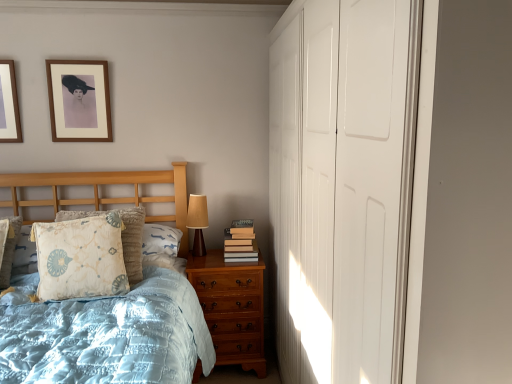
Image resolution: width=512 pixels, height=384 pixels. I want to click on vacant space in front of matte brown wood table lamp at right, so click(198, 261).